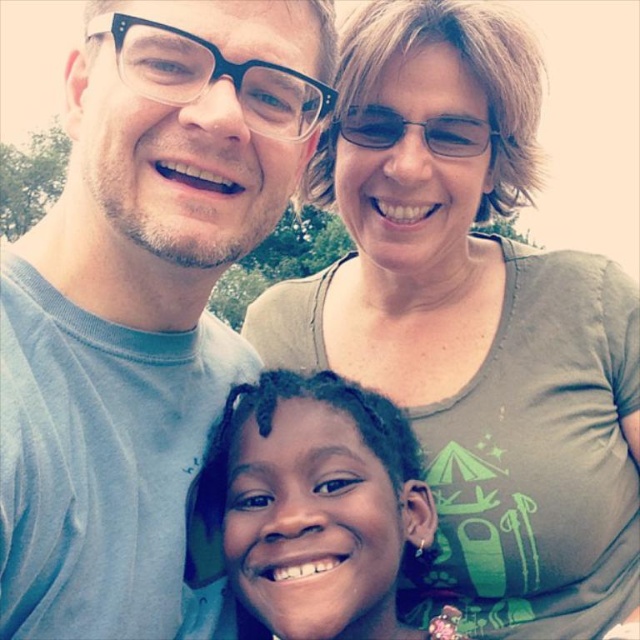
Question: Does light blue t-shirt at left appear under dark skin hair at center?

Choices:
 (A) no
 (B) yes

Answer: (A)

Question: Which point is farther to the camera?

Choices:
 (A) dark skin hair at center
 (B) clear plastic glasses at upper center
 (C) green matte shirt at upper center

Answer: (B)

Question: Which object is closer to the camera taking this photo?

Choices:
 (A) light blue t-shirt at left
 (B) clear plastic glasses at upper left
 (C) clear plastic glasses at upper center

Answer: (A)

Question: Is dark skin hair at center further to the viewer compared to clear plastic glasses at upper center?

Choices:
 (A) no
 (B) yes

Answer: (A)

Question: Does clear plastic glasses at upper left have a greater width compared to clear plastic glasses at upper center?

Choices:
 (A) no
 (B) yes

Answer: (B)

Question: Which object appears farthest from the camera in this image?

Choices:
 (A) clear plastic glasses at upper left
 (B) light blue t-shirt at left
 (C) clear plastic glasses at upper center
 (D) dark skin hair at center

Answer: (C)